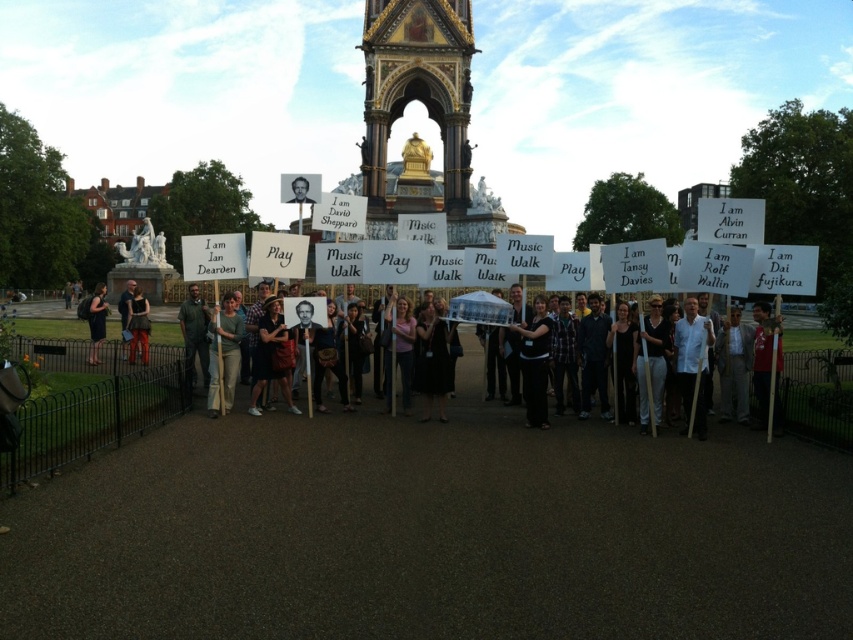
Question: Can you confirm if dark green shirt at center is wider than matte black dress at center?

Choices:
 (A) yes
 (B) no

Answer: (A)

Question: Where is dark green shirt at center located in relation to matte black dress at center in the image?

Choices:
 (A) right
 (B) left

Answer: (A)

Question: Considering the real-world distances, which object is farthest from the dark gray shirt at center?

Choices:
 (A) matte black dress at center
 (B) green cotton shirt at center
 (C) dark brown leather jacket at center
 (D) dark green shirt at center

Answer: (C)

Question: Which object is positioned closest to the black fabric dress at lower left?

Choices:
 (A) green cotton shirt at center
 (B) matte black dress at center
 (C) dark gray shirt at center
 (D) dark brown leather jacket at center

Answer: (D)

Question: Can you confirm if matte black dress at center is positioned below black fabric dress at lower left?

Choices:
 (A) no
 (B) yes

Answer: (B)

Question: Among these objects, which one is farthest from the camera?

Choices:
 (A) green cotton shirt at center
 (B) dark green shirt at center

Answer: (A)